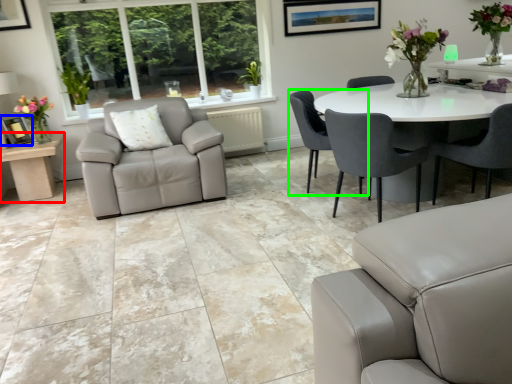
Question: Considering the real-world distances, which object is farthest from table (highlighted by a red box)? picture frame (highlighted by a blue box) or chair (highlighted by a green box)?

Choices:
 (A) picture frame
 (B) chair

Answer: (B)